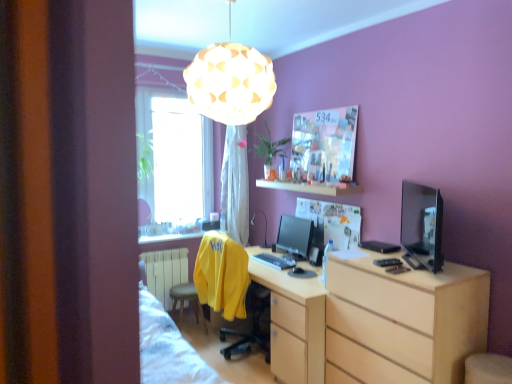
Question: Does satin black monitor at center, which appears as the first computer monitor when viewed from the left, contain white metallic radiator at lower left?

Choices:
 (A) no
 (B) yes

Answer: (A)

Question: From a real-world perspective, is satin black monitor at center, which is the 2th computer monitor from right to left, physically above white metallic radiator at lower left?

Choices:
 (A) no
 (B) yes

Answer: (B)

Question: Is satin black monitor at center, which is the 2th computer monitor from right to left, thinner than white metallic radiator at lower left?

Choices:
 (A) no
 (B) yes

Answer: (A)

Question: Is satin black monitor at center, which appears as the first computer monitor when viewed from the left, at the left side of white metallic radiator at lower left?

Choices:
 (A) yes
 (B) no

Answer: (B)

Question: Is satin black monitor at center, the 1th computer monitor viewed from the back, shorter than white metallic radiator at lower left?

Choices:
 (A) no
 (B) yes

Answer: (B)

Question: Based on their sizes in the image, would you say white metallic radiator at lower left is bigger or smaller than matte black monitor at right, the second computer monitor positioned from the back?

Choices:
 (A) big
 (B) small

Answer: (A)

Question: Relative to matte black monitor at right, the second computer monitor positioned from the back, is white metallic radiator at lower left in front or behind?

Choices:
 (A) behind
 (B) front

Answer: (A)

Question: From the image's perspective, is white metallic radiator at lower left located above or below matte black monitor at right, placed as the 1th computer monitor when sorted from right to left?

Choices:
 (A) above
 (B) below

Answer: (B)

Question: Is white metallic radiator at lower left wider or thinner than matte black monitor at right, which ranks as the 2th computer monitor in left-to-right order?

Choices:
 (A) thin
 (B) wide

Answer: (B)

Question: Is light wood chest of drawers at lower right spatially inside white textured lampshade at upper center, or outside of it?

Choices:
 (A) inside
 (B) outside

Answer: (B)

Question: In terms of width, does light wood chest of drawers at lower right look wider or thinner when compared to white textured lampshade at upper center?

Choices:
 (A) thin
 (B) wide

Answer: (A)

Question: Is light wood chest of drawers at lower right taller or shorter than white textured lampshade at upper center?

Choices:
 (A) short
 (B) tall

Answer: (B)

Question: From a real-world perspective, is light wood chest of drawers at lower right positioned above or below white textured lampshade at upper center?

Choices:
 (A) below
 (B) above

Answer: (A)

Question: Choose the correct answer: Is white metallic radiator at lower left inside white glossy shelf at upper center or outside it?

Choices:
 (A) inside
 (B) outside

Answer: (B)

Question: Is white metallic radiator at lower left wider or thinner than white glossy shelf at upper center?

Choices:
 (A) wide
 (B) thin

Answer: (B)